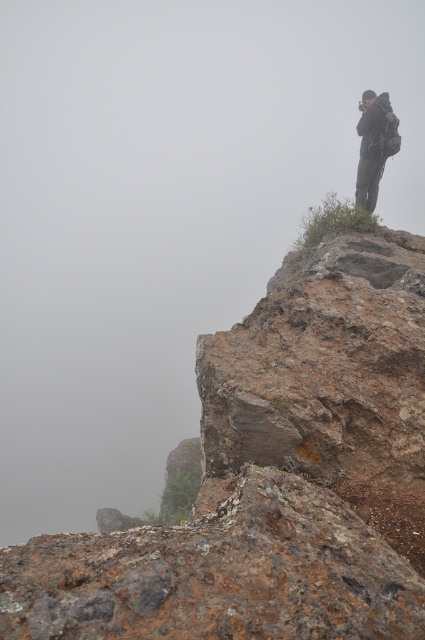
Question: Is the position of rusty rock cliff at upper right more distant than that of dark gray backpack at upper right?

Choices:
 (A) yes
 (B) no

Answer: (B)

Question: Among these objects, which one is nearest to the camera?

Choices:
 (A) dark gray backpack at upper right
 (B) rusty rock cliff at upper right

Answer: (B)

Question: Can you confirm if rusty rock cliff at upper right is positioned above rusty rock at center?

Choices:
 (A) no
 (B) yes

Answer: (B)

Question: Where is rusty rock cliff at upper right located in relation to dark gray backpack at upper right in the image?

Choices:
 (A) below
 (B) above

Answer: (A)

Question: Which object is the closest to the rusty rock cliff at upper right?

Choices:
 (A) dark gray backpack at upper right
 (B) rusty rock at center

Answer: (B)

Question: Which object is closer to the camera taking this photo?

Choices:
 (A) rusty rock cliff at upper right
 (B) dark gray backpack at upper right
 (C) rusty rock at center

Answer: (C)